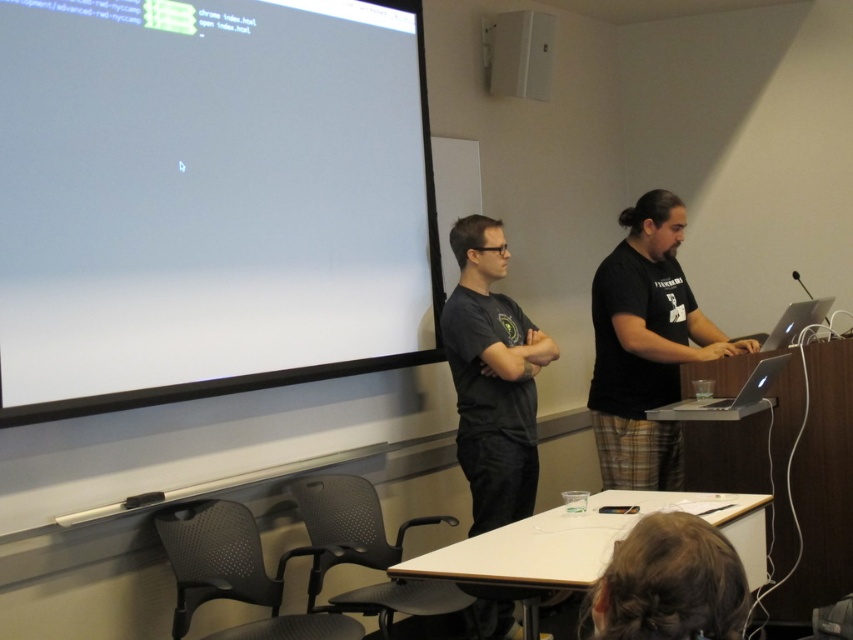
Who is higher up, white glossy projection screen at upper left or black matte shirt at right?

white glossy projection screen at upper left

Can you confirm if white glossy projection screen at upper left is positioned above black matte shirt at right?

Correct, white glossy projection screen at upper left is located above black matte shirt at right.

Image resolution: width=853 pixels, height=640 pixels. What do you see at coordinates (207, 196) in the screenshot? I see `white glossy projection screen at upper left` at bounding box center [207, 196].

At what (x,y) coordinates should I click in order to perform the action: click on white glossy projection screen at upper left. Please return your answer as a coordinate pair (x, y). This screenshot has width=853, height=640. Looking at the image, I should click on (207, 196).

In the scene shown: Is black matte shirt at right taller than white plastic speaker at upper center?

Yes.

Is point (660, 192) farther from viewer compared to point (508, 36)?

No, (660, 192) is in front of (508, 36).

Find the location of a particular element. The width and height of the screenshot is (853, 640). black matte shirt at right is located at coordinates (645, 346).

At what (x,y) coordinates should I click in order to perform the action: click on black matte shirt at right. Please return your answer as a coordinate pair (x, y). This screenshot has height=640, width=853. Looking at the image, I should click on (645, 346).

Who is lower down, white glossy projection screen at upper left or brown hair at lower center?

brown hair at lower center

Does white glossy projection screen at upper left have a larger size compared to brown hair at lower center?

Correct, white glossy projection screen at upper left is larger in size than brown hair at lower center.

Describe the element at coordinates (207, 196) in the screenshot. This screenshot has height=640, width=853. I see `white glossy projection screen at upper left` at that location.

Where is `white glossy projection screen at upper left`? white glossy projection screen at upper left is located at coordinates (207, 196).